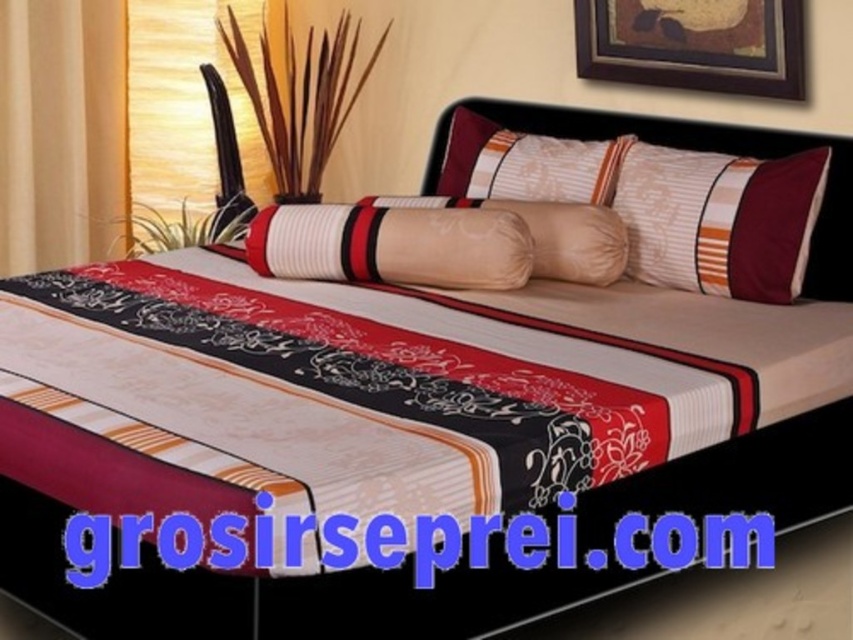
Question: Which point is farther to the camera?

Choices:
 (A) (709, 49)
 (B) (576, 218)
 (C) (741, 280)

Answer: (A)

Question: Which point is farther to the camera?

Choices:
 (A) (718, 0)
 (B) (822, 278)

Answer: (A)

Question: Is matte white pillow at center positioned in front of beige fabric pillow at center?

Choices:
 (A) no
 (B) yes

Answer: (A)

Question: Does striped fabric pillow at upper right come in front of beige fabric pillow at center?

Choices:
 (A) no
 (B) yes

Answer: (B)

Question: Is matte white pillow at center positioned at the back of wooden framed artwork at upper center?

Choices:
 (A) yes
 (B) no

Answer: (B)

Question: Which point is closer to the camera?

Choices:
 (A) beige fabric pillow at center
 (B) wooden framed artwork at upper center
 (C) silky fabric headboard at center

Answer: (C)